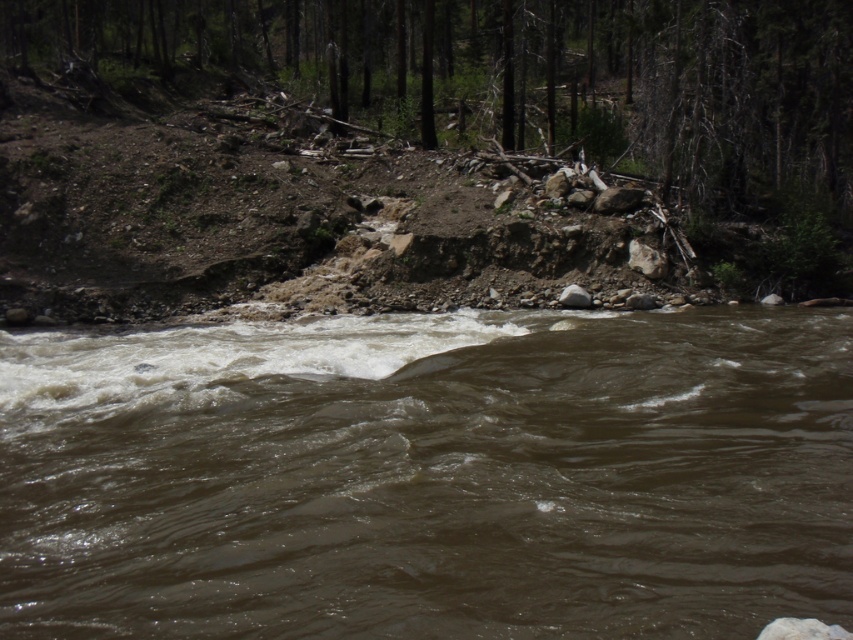
Who is more forward, (155,384) or (698,61)?

Point (155,384) is more forward.

The width and height of the screenshot is (853, 640). I want to click on brown muddy water at center, so click(x=428, y=476).

The image size is (853, 640). I want to click on brown muddy water at center, so click(x=428, y=476).